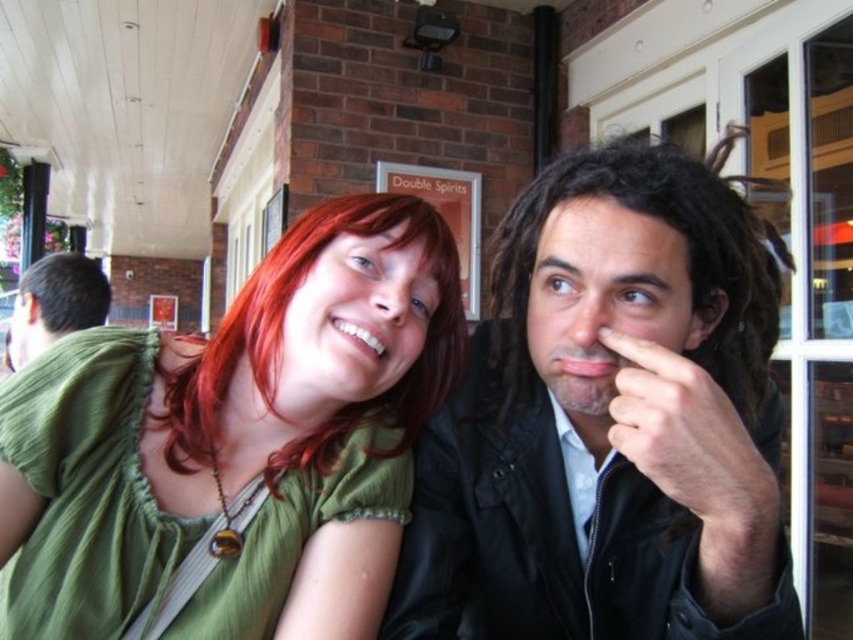
You are a photographer trying to adjust the lighting between the matte black jacket at center and the green fabric shirt at center. Since the black jacket absorbs more light, which object should you focus the light on to ensure both are well lit?

The matte black jacket at center absorbs more light, so you should focus the light on the matte black jacket at center to ensure both the matte black jacket at center and the green fabric shirt at center are well lit.

You are standing in front of the white door and want to reach the matte black jacket at center. Which direction should you move relative to the brick wall with the sign Double Spirits?

The matte black jacket at center is located at coordinates (608, 422), so you should move towards the right side of the brick wall with the sign Double Spirits to reach it.

You are a photographer setting up a camera to take a portrait of the two people in the scene. You want to ensure that both the matte black jacket at center and the shiny red hair at center are clearly visible. Based on their sizes, which object should you focus on first to ensure proper framing?

The matte black jacket at center is wider than the shiny red hair at center, so you should focus on the matte black jacket at center first to ensure proper framing.